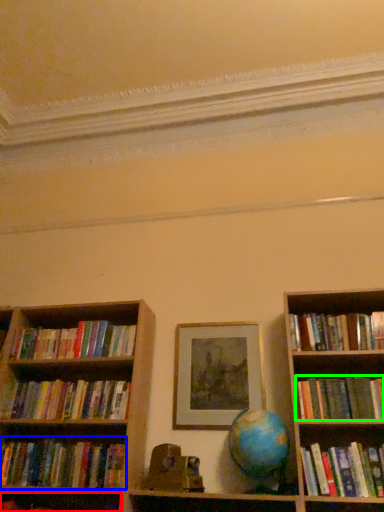
Question: Based on their relative distances, which object is nearer to book (highlighted by a red box)? Choose from book (highlighted by a blue box) and book (highlighted by a green box).

Choices:
 (A) book
 (B) book

Answer: (A)